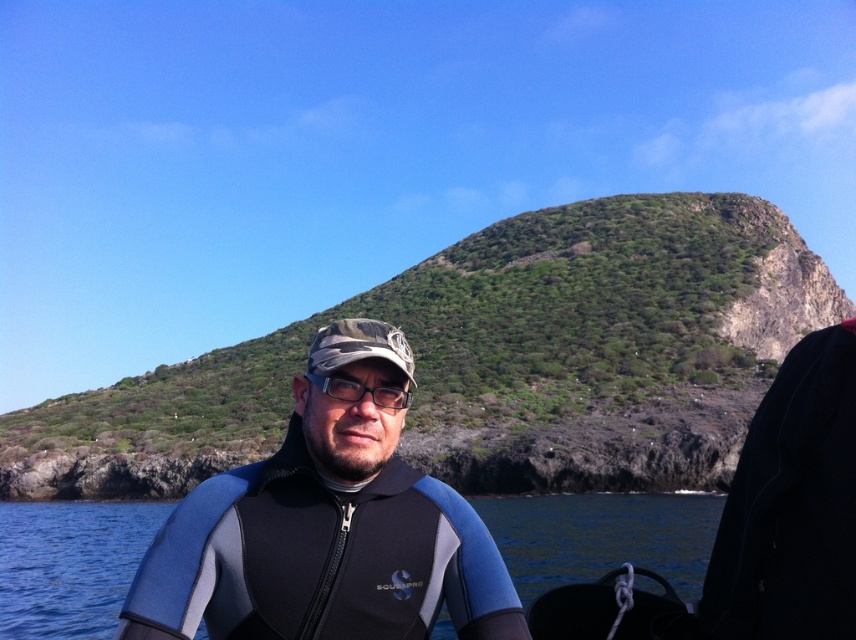
Between blue matte water at center and transparent plastic glasses at center, which one has more height?

With more height is blue matte water at center.

Is point (575, 557) farther from viewer compared to point (358, 385)?

Yes.

Where is `blue matte water at center`? blue matte water at center is located at coordinates (601, 536).

Which of these two, blue neoprene wetsuit at center or blue matte water at center, stands taller?

blue matte water at center is taller.

Describe the element at coordinates (324, 545) in the screenshot. This screenshot has width=856, height=640. I see `blue neoprene wetsuit at center` at that location.

Identify the location of blue neoprene wetsuit at center. (324, 545).

Between point (402, 413) and point (328, 376), which one is positioned in front?

Point (328, 376) is more forward.

Who is taller, blue neoprene wetsuit at center or transparent plastic glasses at center?

Standing taller between the two is blue neoprene wetsuit at center.

Find the location of a particular element. blue neoprene wetsuit at center is located at coordinates (324, 545).